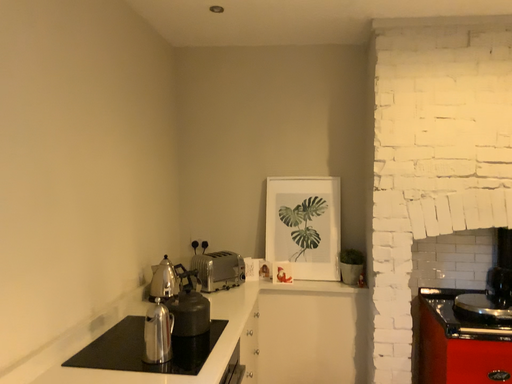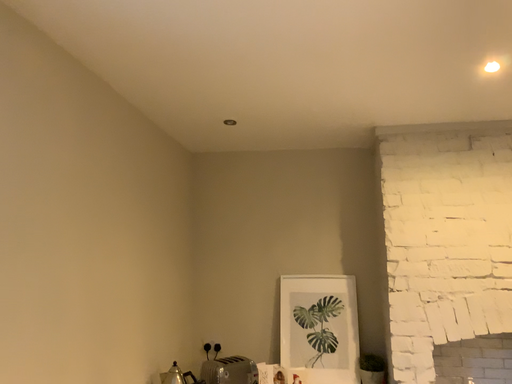
Question: Which way did the camera rotate in the video?

Choices:
 (A) rotated upward
 (B) rotated downward

Answer: (A)